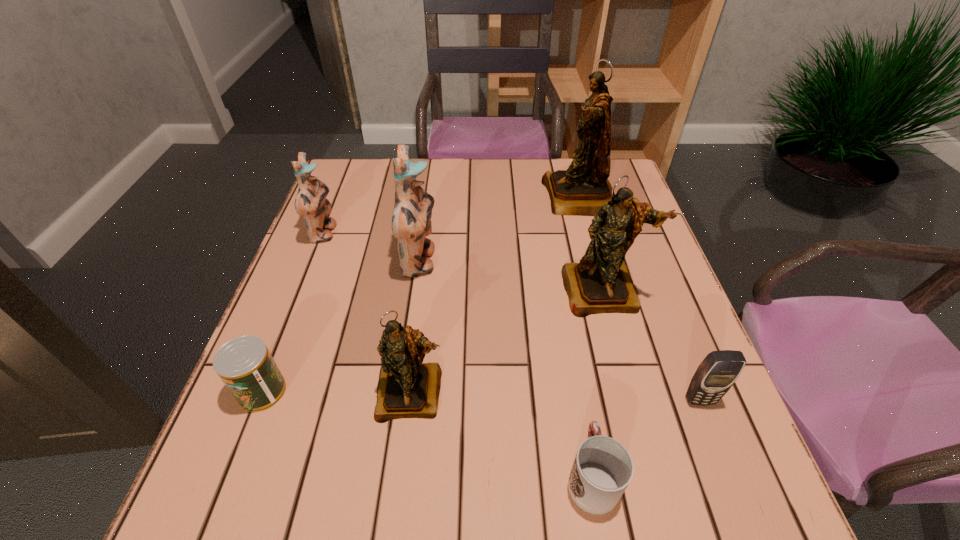
This screenshot has width=960, height=540. Identify the location of free space located 0.170m on the front of the can. (215, 514).

Image resolution: width=960 pixels, height=540 pixels. In order to click on free region located 0.380m on the handle side of the shortest object in this screenshot , I will do `click(558, 284)`.

Image resolution: width=960 pixels, height=540 pixels. I want to click on vacant region located 0.200m on the handle side of the shortest object, so click(569, 347).

Identify the location of vacant region located on the handle side of the shortest object. (560, 293).

This screenshot has height=540, width=960. What are the coordinates of `object present at the far edge` in the screenshot? It's located at (581, 190).

What are the coordinates of `object present at the near edge` in the screenshot? It's located at (x=602, y=469).

Where is `figurine situated at the left edge`? figurine situated at the left edge is located at coordinates (311, 201).

Locate an element on the screen. can situated at the left edge is located at coordinates (245, 365).

This screenshot has height=540, width=960. What are the coordinates of `cellular telephone at the right edge` in the screenshot? It's located at [716, 374].

Locate an element on the screen. object that is positioned at the far right corner is located at coordinates (581, 190).